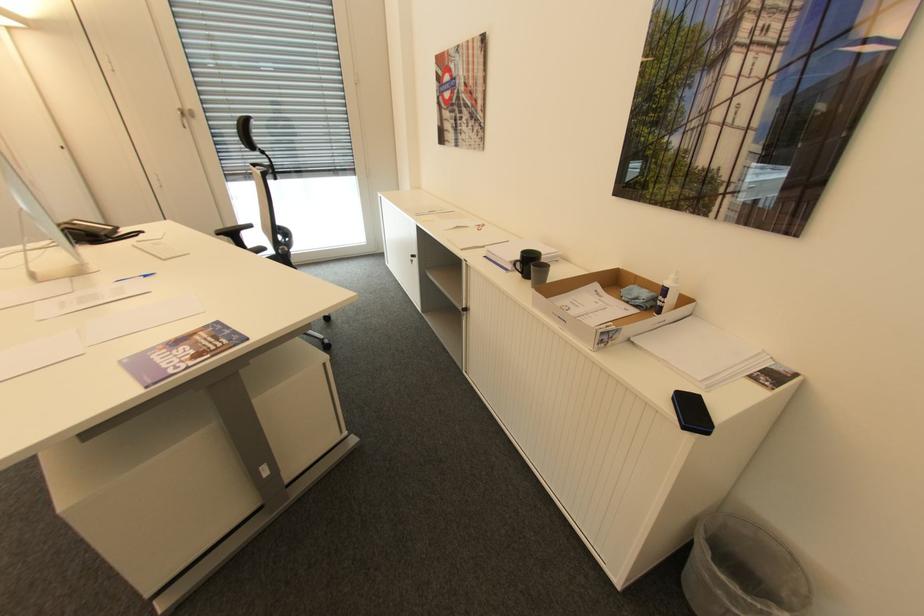
In order to click on chair armrest in this screenshot , I will do `click(234, 233)`.